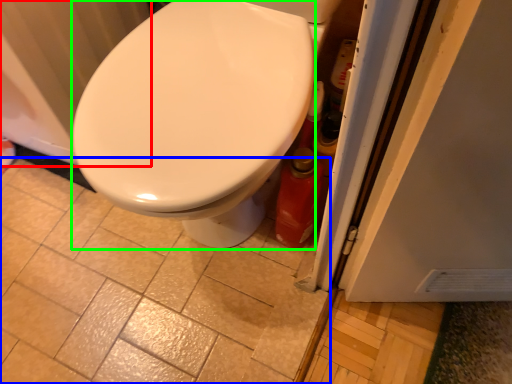
Question: Considering the real-world distances, which object is farthest from radiator (highlighted by a red box)? ceramic tile (highlighted by a blue box) or bidet (highlighted by a green box)?

Choices:
 (A) ceramic tile
 (B) bidet

Answer: (A)